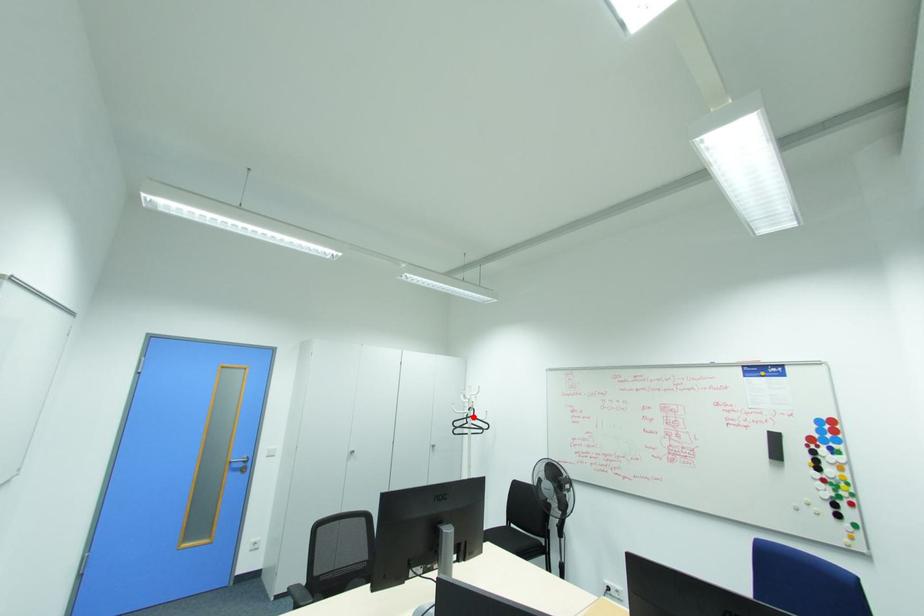
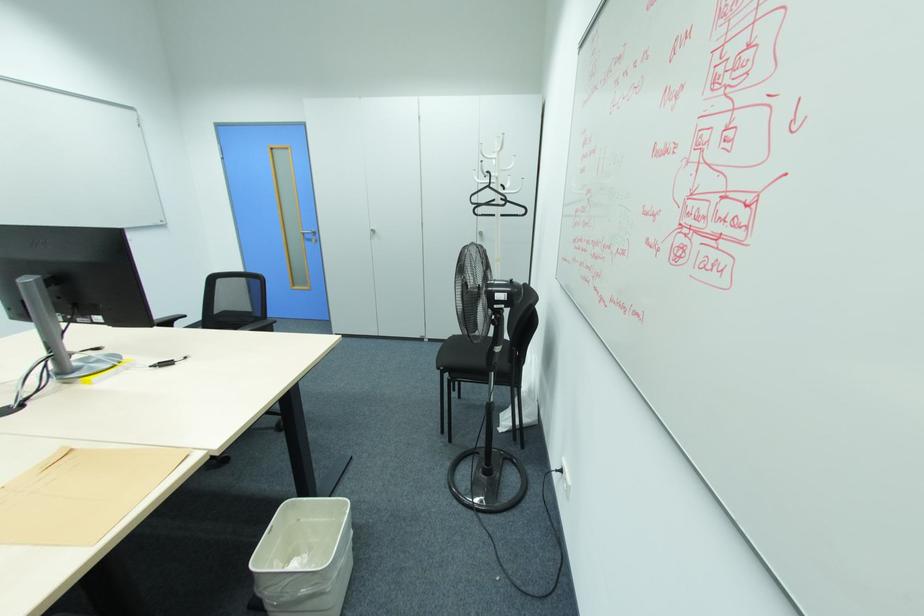
Question: I am providing you with two images of the same scene from different viewpoints. Given a red point in image1, look at the same physical point in image2. Is it:

Choices:
 (A) Closer to the viewpoint
 (B) Farther from the viewpoint

Answer: (A)